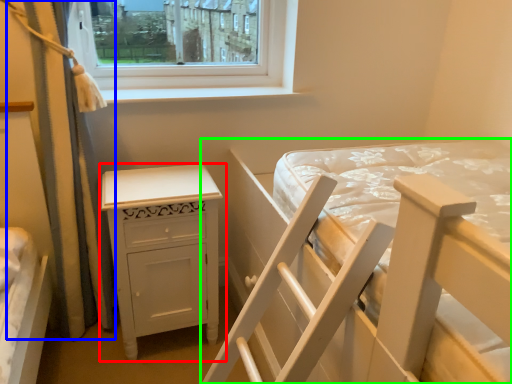
Question: Considering the real-world distances, which object is closest to nightstand (highlighted by a red box)? curtain (highlighted by a blue box) or bed (highlighted by a green box).

Choices:
 (A) curtain
 (B) bed

Answer: (A)